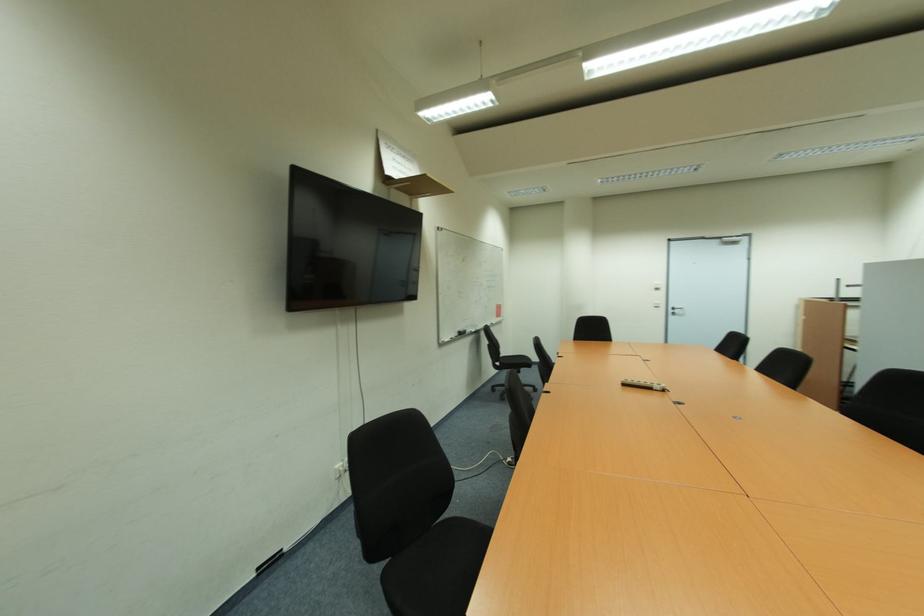
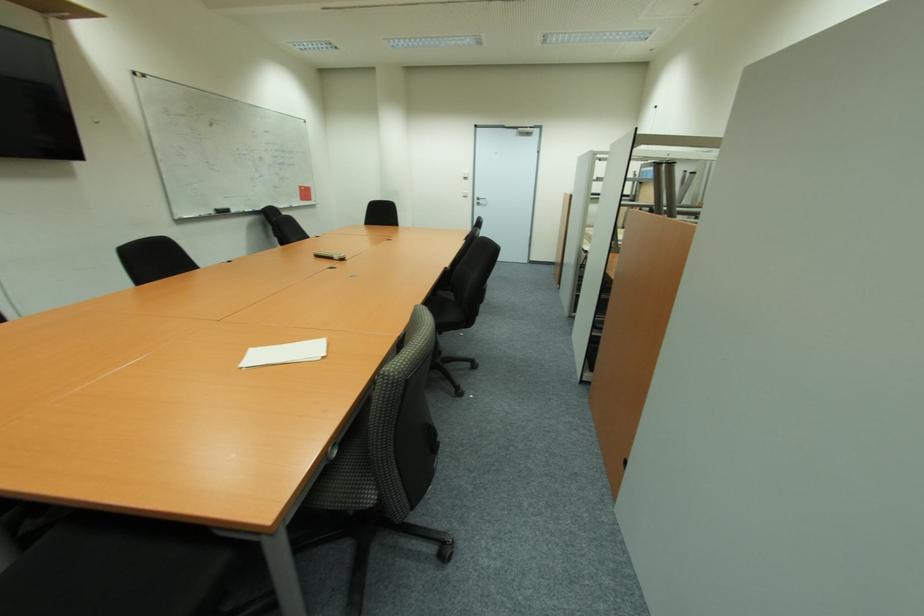
Where in the second image is the point corresponding to [679,312] from the first image?

(483, 203)